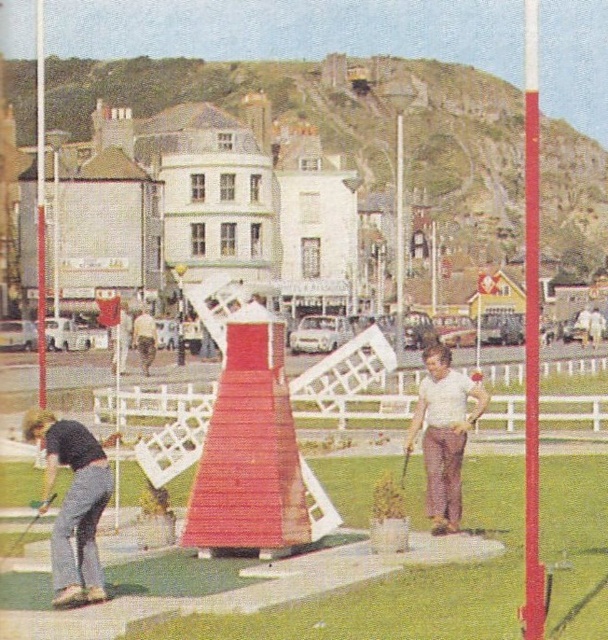
You are a mini golf player trying to decide where to place your golf ball. You see the wooden windmill at center and the white matte golf club at center. Which object is wider?

The wooden windmill at center is wider than the white matte golf club at center according to the description.

You are a miniature golf player trying to decide where to aim your shot. You notice the wooden windmill at center and the dark gray pants at lower left. Which object is wider?

The wooden windmill at center is wider than the dark gray pants at lower left.

You are playing mini golf and need to hit the ball past the dark gray pants at lower left and the smooth red pole at right. Which obstacle is closer to your current position?

The dark gray pants at lower left is closer to your current position because it is to the left of the smooth red pole at right, meaning it is positioned nearer to you.